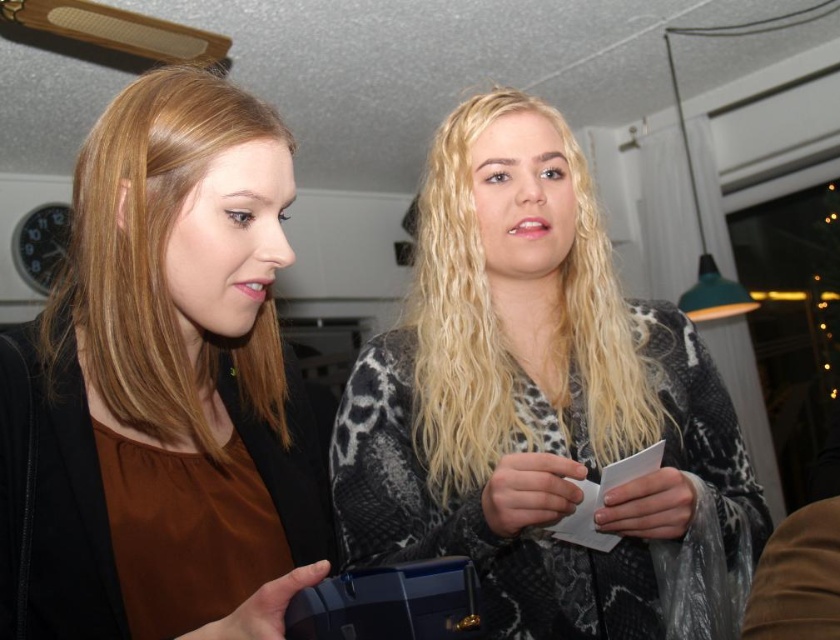
Question: Which point is closer to the camera?

Choices:
 (A) leopard print sweater at center
 (B) brown matte shirt at left

Answer: (B)

Question: Which point is closer to the camera?

Choices:
 (A) blondehair texturehair at center
 (B) leopard print sweater at center

Answer: (B)

Question: Can you confirm if brown matte shirt at left is positioned to the right of blondehair texturehair at center?

Choices:
 (A) yes
 (B) no

Answer: (B)

Question: Does leopard print sweater at center lie behind brown matte shirt at left?

Choices:
 (A) no
 (B) yes

Answer: (B)

Question: In this image, where is leopard print sweater at center located relative to blondehair texturehair at center?

Choices:
 (A) left
 (B) right

Answer: (B)

Question: Considering the real-world distances, which object is farthest from the leopard print sweater at center?

Choices:
 (A) blondehair texturehair at center
 (B) brown matte shirt at left

Answer: (B)